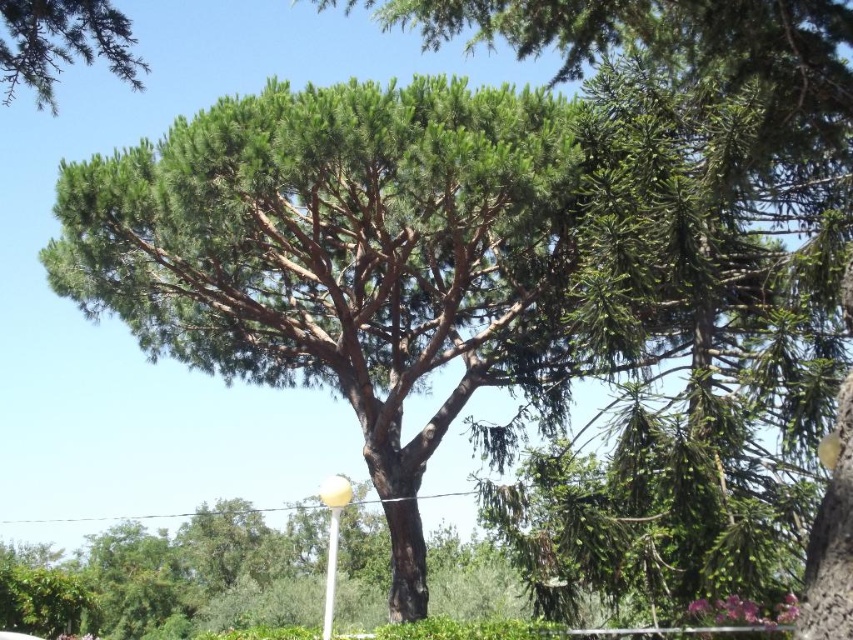
Question: Does green leafy tree at center appear on the left side of green needle-like at upper left?

Choices:
 (A) yes
 (B) no

Answer: (B)

Question: Is green needle-like at center smaller than green needle-like at upper left?

Choices:
 (A) yes
 (B) no

Answer: (A)

Question: Which object is farther from the camera taking this photo?

Choices:
 (A) green needle-like at upper left
 (B) green needle-like at center
 (C) green leafy tree at center

Answer: (C)

Question: Which object appears closest to the camera in this image?

Choices:
 (A) green leafy tree at center
 (B) green needle-like at upper left
 (C) green needle-like at center

Answer: (C)

Question: From the image, what is the correct spatial relationship of green leafy tree at center in relation to green needle-like at upper left?

Choices:
 (A) right
 (B) left

Answer: (A)

Question: Which of these objects is positioned farthest from the green leafy tree at center?

Choices:
 (A) green needle-like at upper left
 (B) green needle-like at center

Answer: (A)